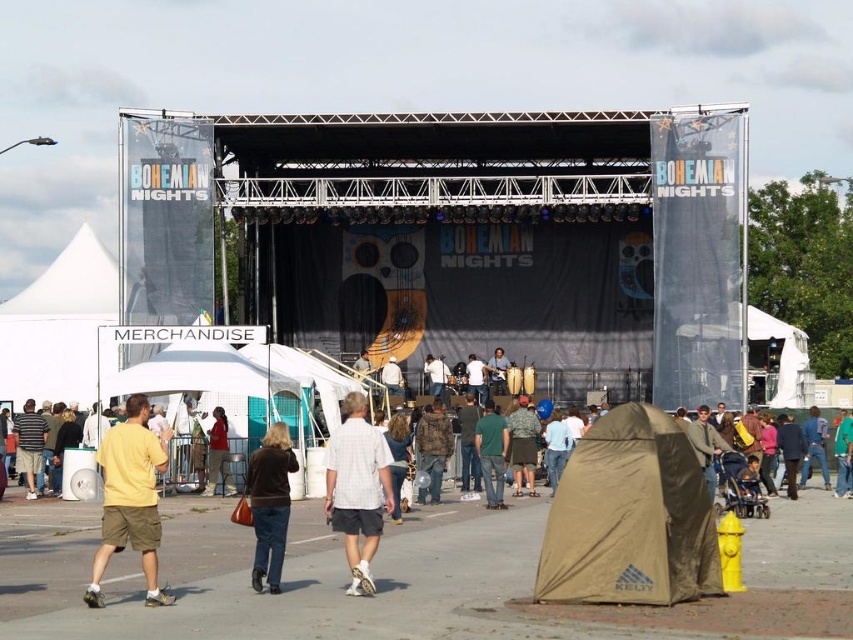
Between white cotton shirt at center and green cotton shirt at center, which one is positioned lower?

green cotton shirt at center

Is white cotton shirt at center positioned at the back of green cotton shirt at center?

No.

Measure the distance between white cotton shirt at center and camera.

They are 161.93 feet apart.

In order to click on white cotton shirt at center in this screenshot , I will do `click(357, 488)`.

Which is behind, point (271, 589) or point (514, 433)?

Positioned behind is point (514, 433).

Does brown leather jacket at center have a larger size compared to camouflage fabric shorts at center?

Correct, brown leather jacket at center is larger in size than camouflage fabric shorts at center.

Consider the image. Who is more distant from viewer, (x=285, y=481) or (x=515, y=496)?

Positioned behind is point (x=515, y=496).

Locate an element on the screen. This screenshot has width=853, height=640. brown leather jacket at center is located at coordinates (270, 502).

Who is more distant from viewer, (534,436) or (549,476)?

The point (549,476) is behind.

Does camouflage fabric shorts at center have a lesser width compared to light blue shirt at center?

No, camouflage fabric shorts at center is not thinner than light blue shirt at center.

Is point (537, 433) positioned behind point (563, 436)?

No, (537, 433) is closer to viewer.

You are a GUI agent. You are given a task and a screenshot of the screen. Output one action in this format:
    pyautogui.click(x=<x>, y=<y>)
    Task: Click on the camouflage fabric shorts at center
    
    Given the screenshot: What is the action you would take?
    pyautogui.click(x=521, y=445)